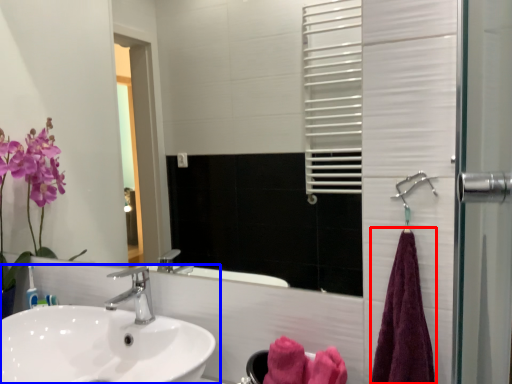
Question: Which of the following is the closest to the observer, bath towel (highlighted by a red box) or sink (highlighted by a blue box)?

Choices:
 (A) bath towel
 (B) sink

Answer: (B)